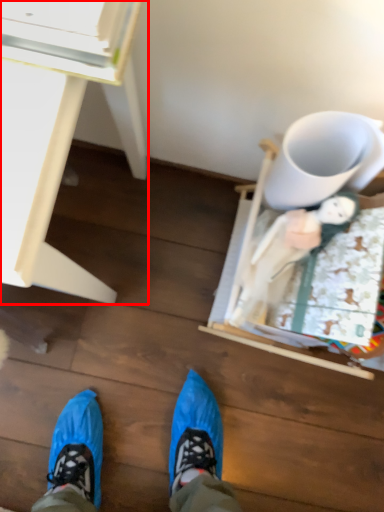
Question: In this image, where is desk (annotated by the red box) located relative to mug?

Choices:
 (A) left
 (B) right

Answer: (A)